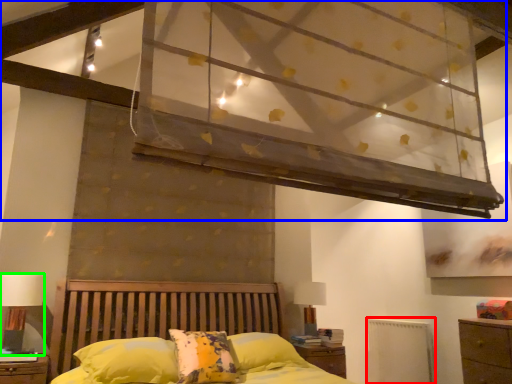
Question: Based on their relative distances, which object is nearer to radiator (highlighted by a red box)? Choose from canopy bed (highlighted by a blue box) and table lamp (highlighted by a green box).

Choices:
 (A) canopy bed
 (B) table lamp

Answer: (A)